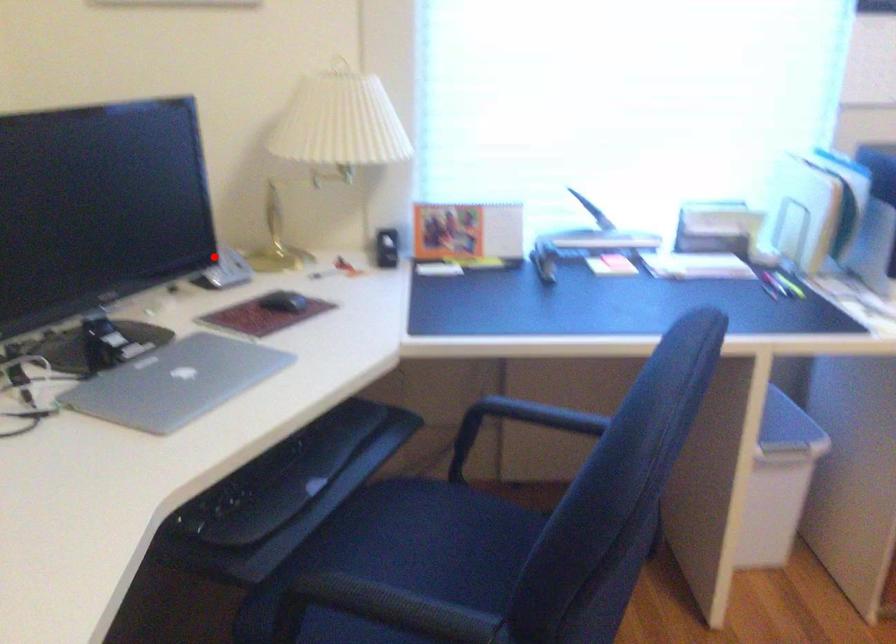
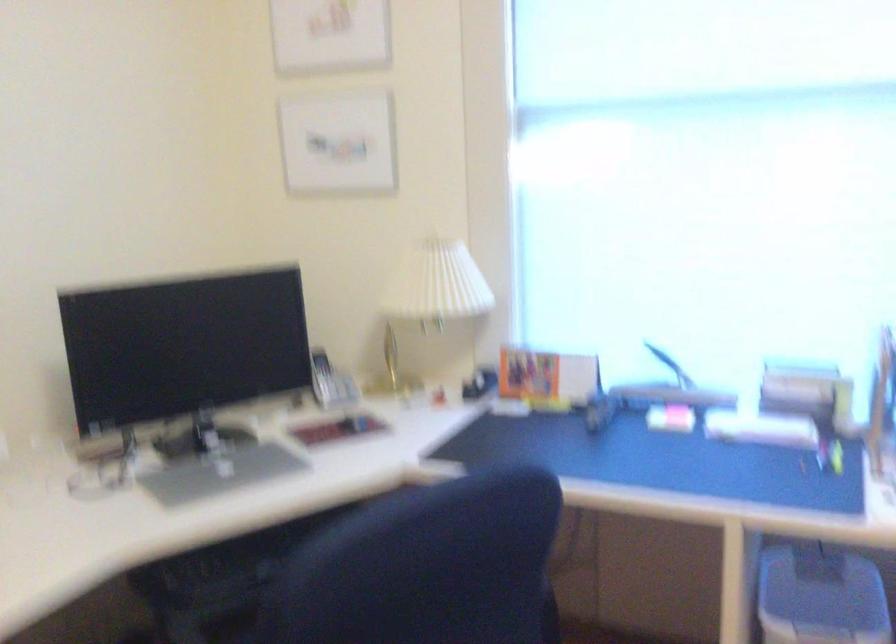
Locate, in the second image, the point that corresponds to the highlighted location in the first image.

(330, 382)